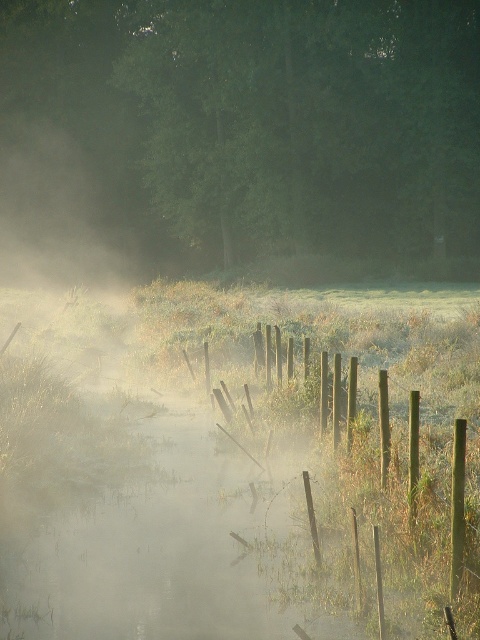
Between green matte tree at upper center and green wooden fence at center, which one appears on the right side from the viewer's perspective?

Positioned to the right is green wooden fence at center.

Is green matte tree at upper center bigger than green wooden fence at center?

Yes, green matte tree at upper center is bigger than green wooden fence at center.

Measure the distance between green matte tree at upper center and camera.

They are 36.54 meters apart.

Locate an element on the screen. green matte tree at upper center is located at coordinates (312, 125).